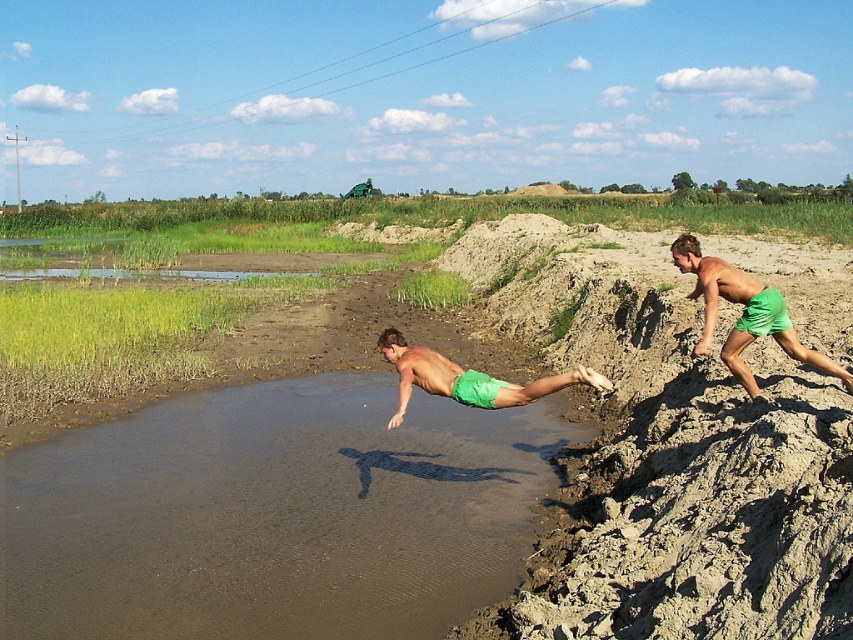
You are a photographer trying to capture the two people in the scene. You notice that the green fabric shorts at right and the green matte shorts at center are overlapping. Which pair of shorts is covering part of the other?

The green fabric shorts at right is positioned over green matte shorts at center, so it is covering part of the latter.

Consider the image. You are standing in the scene and see the green fabric shorts at right. Where exactly are they located in terms of coordinates?

The green fabric shorts at right are located at coordinates point (743, 314).

You are a photographer trying to capture the scene from the ground level. Which of the two people wearing green shorts, the one with green fabric shorts at right or the green matte shorts at center, will appear larger in your photo?

The green fabric shorts at right will appear larger in the photo because it is much taller than the green matte shorts at center.